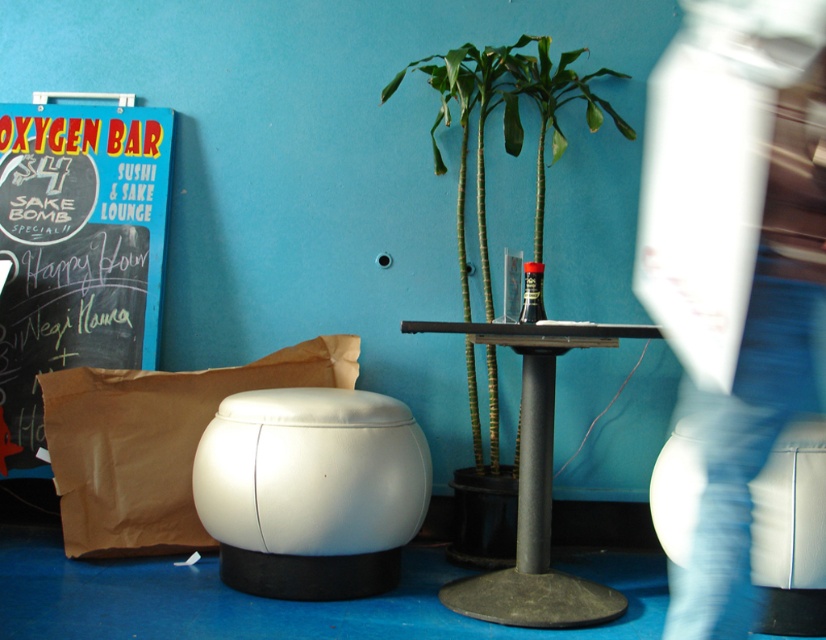
Which is more to the right, brown paper bag at left or black glass bottle at center?

black glass bottle at center

The width and height of the screenshot is (826, 640). Describe the element at coordinates (155, 442) in the screenshot. I see `brown paper bag at left` at that location.

At what (x,y) coordinates should I click in order to perform the action: click on brown paper bag at left. Please return your answer as a coordinate pair (x, y). Looking at the image, I should click on (155, 442).

Does point (20, 305) come closer to viewer compared to point (274, 541)?

No, it is not.

Does black chalkboard at left appear under white leather ottoman at center?

No, black chalkboard at left is not below white leather ottoman at center.

Is point (134, 132) positioned after point (409, 426)?

Yes, point (134, 132) is farther from viewer.

At what (x,y) coordinates should I click in order to perform the action: click on black chalkboard at left. Please return your answer as a coordinate pair (x, y). The height and width of the screenshot is (640, 826). Looking at the image, I should click on (76, 250).

Does metallic gray table at center have a smaller size compared to black glass bottle at center?

No, metallic gray table at center is not smaller than black glass bottle at center.

In the scene shown: Who is lower down, metallic gray table at center or black glass bottle at center?

metallic gray table at center is lower down.

At what (x,y) coordinates should I click in order to perform the action: click on metallic gray table at center. Please return your answer as a coordinate pair (x, y). Looking at the image, I should click on (534, 486).

Identify the location of metallic gray table at center. (534, 486).